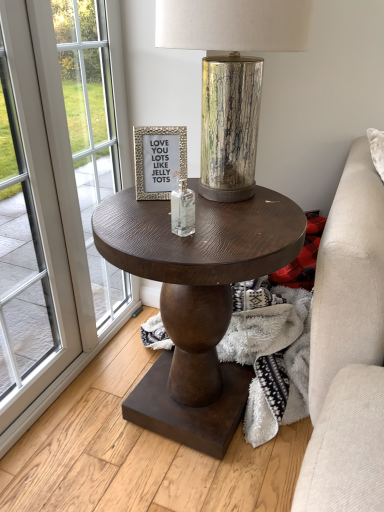
Question: Considering the relative sizes of clear glass bottle at center and silver textured frame at center in the image provided, is clear glass bottle at center taller than silver textured frame at center?

Choices:
 (A) yes
 (B) no

Answer: (B)

Question: Is clear glass bottle at center smaller than silver textured frame at center?

Choices:
 (A) yes
 (B) no

Answer: (A)

Question: From the image's perspective, is clear glass bottle at center under silver textured frame at center?

Choices:
 (A) yes
 (B) no

Answer: (A)

Question: From the image's perspective, is clear glass bottle at center on silver textured frame at center?

Choices:
 (A) no
 (B) yes

Answer: (A)

Question: Is clear glass bottle at center at the left side of silver textured frame at center?

Choices:
 (A) no
 (B) yes

Answer: (A)

Question: Does clear glass bottle at center appear on the right side of silver textured frame at center?

Choices:
 (A) no
 (B) yes

Answer: (B)

Question: From the image's perspective, is white glass window at left above white glass screen door at left?

Choices:
 (A) no
 (B) yes

Answer: (A)

Question: Can white glass screen door at left be found inside white glass window at left?

Choices:
 (A) yes
 (B) no

Answer: (A)

Question: From a real-world perspective, does white glass window at left sit lower than white glass screen door at left?

Choices:
 (A) yes
 (B) no

Answer: (A)

Question: Can you confirm if white glass window at left is shorter than white glass screen door at left?

Choices:
 (A) no
 (B) yes

Answer: (A)

Question: Can you confirm if white glass window at left is positioned to the right of white glass screen door at left?

Choices:
 (A) no
 (B) yes

Answer: (B)

Question: From a real-world perspective, is white glass window at left on white glass screen door at left?

Choices:
 (A) no
 (B) yes

Answer: (A)

Question: From the image's perspective, is dark wood round table at center above clear glass bottle at center?

Choices:
 (A) no
 (B) yes

Answer: (A)